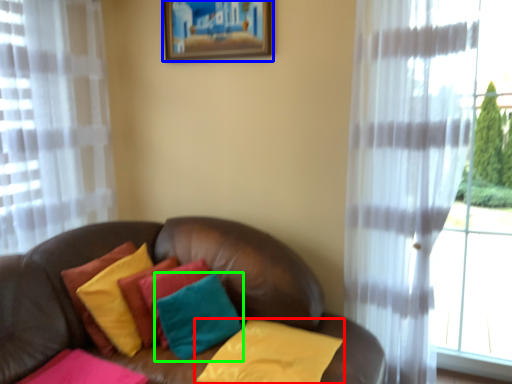
Question: Based on their relative distances, which object is farther from pillow (highlighted by a red box)? Choose from picture frame (highlighted by a blue box) and pillow (highlighted by a green box).

Choices:
 (A) picture frame
 (B) pillow

Answer: (A)